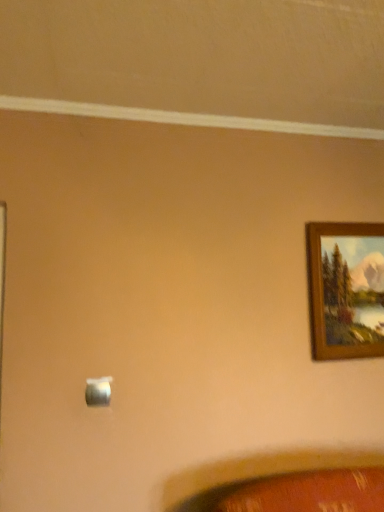
What do you see at coordinates (345, 289) in the screenshot? I see `wooden picture frame at upper right` at bounding box center [345, 289].

Image resolution: width=384 pixels, height=512 pixels. In order to click on wooden picture frame at upper right in this screenshot , I will do pyautogui.click(x=345, y=289).

The height and width of the screenshot is (512, 384). In order to click on satin silver switch at lower center in this screenshot , I will do `click(98, 391)`.

Describe the element at coordinates (98, 391) in the screenshot. I see `satin silver switch at lower center` at that location.

Where is `wooden picture frame at upper right`? The height and width of the screenshot is (512, 384). wooden picture frame at upper right is located at coordinates (345, 289).

Visually, is wooden picture frame at upper right positioned to the left or to the right of satin silver switch at lower center?

wooden picture frame at upper right is to the right of satin silver switch at lower center.

Considering their positions, is wooden picture frame at upper right located in front of or behind satin silver switch at lower center?

wooden picture frame at upper right is positioned farther from the viewer than satin silver switch at lower center.

Considering the positions of points (336, 263) and (101, 387), is point (336, 263) farther from camera compared to point (101, 387)?

Yes, point (336, 263) is farther from viewer.

From the image's perspective, does wooden picture frame at upper right appear lower than satin silver switch at lower center?

Actually, wooden picture frame at upper right appears above satin silver switch at lower center in the image.

From a real-world perspective, is wooden picture frame at upper right physically located above or below satin silver switch at lower center?

wooden picture frame at upper right is above satin silver switch at lower center.

Is wooden picture frame at upper right wider than satin silver switch at lower center?

Correct, the width of wooden picture frame at upper right exceeds that of satin silver switch at lower center.

Who is taller, wooden picture frame at upper right or satin silver switch at lower center?

wooden picture frame at upper right.

In terms of size, does wooden picture frame at upper right appear bigger or smaller than satin silver switch at lower center?

In the image, wooden picture frame at upper right appears to be larger than satin silver switch at lower center.

Is wooden picture frame at upper right not inside satin silver switch at lower center?

Yes, wooden picture frame at upper right is located beyond the bounds of satin silver switch at lower center.

Is the surface of wooden picture frame at upper right in direct contact with satin silver switch at lower center?

No, wooden picture frame at upper right is not touching satin silver switch at lower center.

Is wooden picture frame at upper right oriented towards satin silver switch at lower center?

No, wooden picture frame at upper right is not aimed at satin silver switch at lower center.

From the picture: How different are the orientations of wooden picture frame at upper right and satin silver switch at lower center in degrees?

The angle between the facing direction of wooden picture frame at upper right and the facing direction of satin silver switch at lower center is 0.00876 degrees.

Identify the location of light switch below the wooden picture frame at upper right (from the image's perspective). The image size is (384, 512). (98, 391).

Which is more to the left, satin silver switch at lower center or wooden picture frame at upper right?

Positioned to the left is satin silver switch at lower center.

In the image, is satin silver switch at lower center positioned in front of or behind wooden picture frame at upper right?

Clearly, satin silver switch at lower center is in front of wooden picture frame at upper right.

Considering the points (88, 393) and (357, 301), which point is in front, point (88, 393) or point (357, 301)?

The point (88, 393) is more forward.

From the image's perspective, is satin silver switch at lower center located beneath wooden picture frame at upper right?

Yes.

From a real-world perspective, is satin silver switch at lower center located beneath wooden picture frame at upper right?

Yes, from a real-world perspective, satin silver switch at lower center is beneath wooden picture frame at upper right.

Which of these two, satin silver switch at lower center or wooden picture frame at upper right, is thinner?

satin silver switch at lower center.

Between satin silver switch at lower center and wooden picture frame at upper right, which one has less height?

satin silver switch at lower center.

Is satin silver switch at lower center bigger than wooden picture frame at upper right?

No, satin silver switch at lower center is not bigger than wooden picture frame at upper right.

Do you think satin silver switch at lower center is within wooden picture frame at upper right, or outside of it?

satin silver switch at lower center cannot be found inside wooden picture frame at upper right.

Is satin silver switch at lower center beside wooden picture frame at upper right?

satin silver switch at lower center is not next to wooden picture frame at upper right, and they're not touching.

Does satin silver switch at lower center turn towards wooden picture frame at upper right?

No, satin silver switch at lower center is not turned towards wooden picture frame at upper right.

Can you tell me how much satin silver switch at lower center and wooden picture frame at upper right differ in facing direction?

0.00876 degrees.

Measure the distance between satin silver switch at lower center and wooden picture frame at upper right.

The distance of satin silver switch at lower center from wooden picture frame at upper right is 3.59 feet.

Where is `picture frame behind the satin silver switch at lower center`? This screenshot has width=384, height=512. picture frame behind the satin silver switch at lower center is located at coordinates (345, 289).

Find the location of `light switch that is under the wooden picture frame at upper right (from a real-world perspective)`. light switch that is under the wooden picture frame at upper right (from a real-world perspective) is located at coordinates (98, 391).

You are a GUI agent. You are given a task and a screenshot of the screen. Output one action in this format:
    pyautogui.click(x=<x>, y=<y>)
    Task: Click on the picture frame to the right of satin silver switch at lower center
    This screenshot has width=384, height=512.
    Given the screenshot: What is the action you would take?
    pyautogui.click(x=345, y=289)